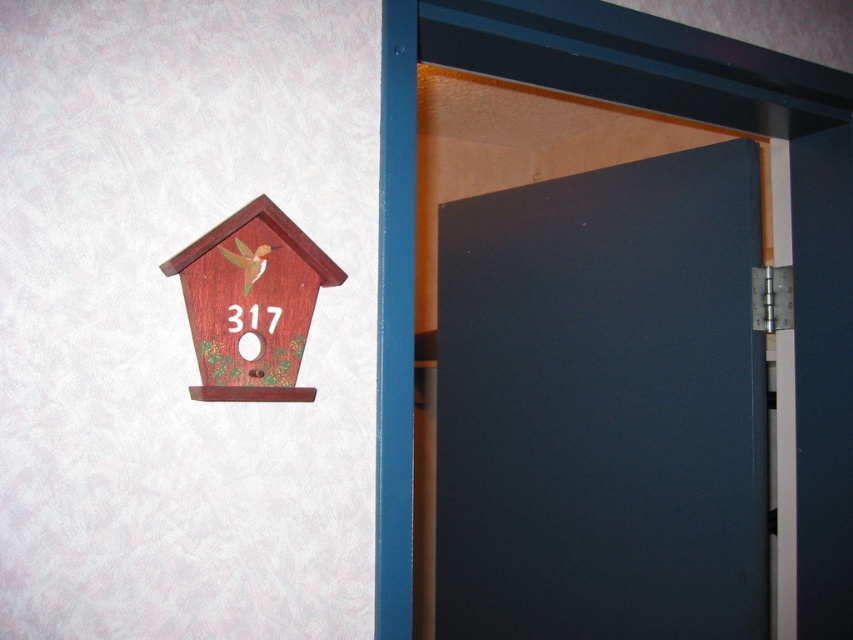
Question: Which point is closer to the camera?

Choices:
 (A) dark blue matte door at center
 (B) wooden birdhouse at left

Answer: (B)

Question: Is dark blue matte door at center positioned before wooden hummingbird at upper left?

Choices:
 (A) yes
 (B) no

Answer: (B)

Question: Which of the following is the closest to the observer?

Choices:
 (A) (486, 336)
 (B) (260, 260)

Answer: (B)

Question: Can you confirm if dark blue matte door at center is bigger than wooden birdhouse at left?

Choices:
 (A) no
 (B) yes

Answer: (B)

Question: Which of these objects is positioned farthest from the dark blue matte door at center?

Choices:
 (A) wooden birdhouse at left
 (B) wooden hummingbird at upper left

Answer: (B)

Question: Does wooden birdhouse at left have a larger size compared to wooden hummingbird at upper left?

Choices:
 (A) no
 (B) yes

Answer: (B)